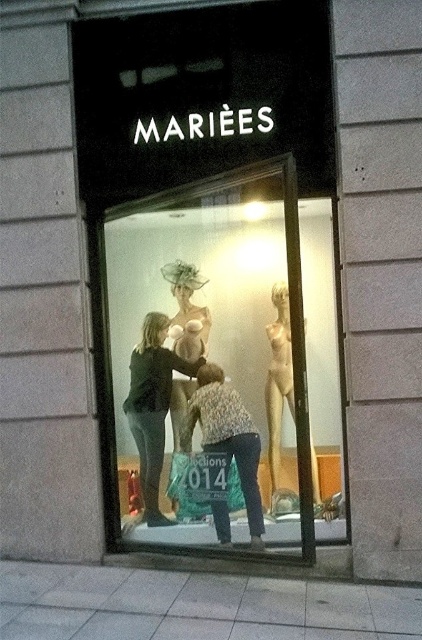
Question: Does dark green fabric dress at center appear over patterned fabric blouse at center?

Choices:
 (A) yes
 (B) no

Answer: (A)

Question: Which point is farther from the camera taking this photo?

Choices:
 (A) (240, 435)
 (B) (110, 512)

Answer: (B)

Question: In this image, where is dark green fabric dress at center located relative to patterned fabric blouse at center?

Choices:
 (A) right
 (B) left

Answer: (B)

Question: Which of the following is the closest to the observer?

Choices:
 (A) (246, 426)
 (B) (259, 285)

Answer: (A)

Question: Among these points, which one is nearest to the camera?

Choices:
 (A) (140, 480)
 (B) (130, 275)
 (C) (213, 401)

Answer: (C)

Question: Is dark green fabric dress at center wider than patterned fabric blouse at center?

Choices:
 (A) yes
 (B) no

Answer: (B)